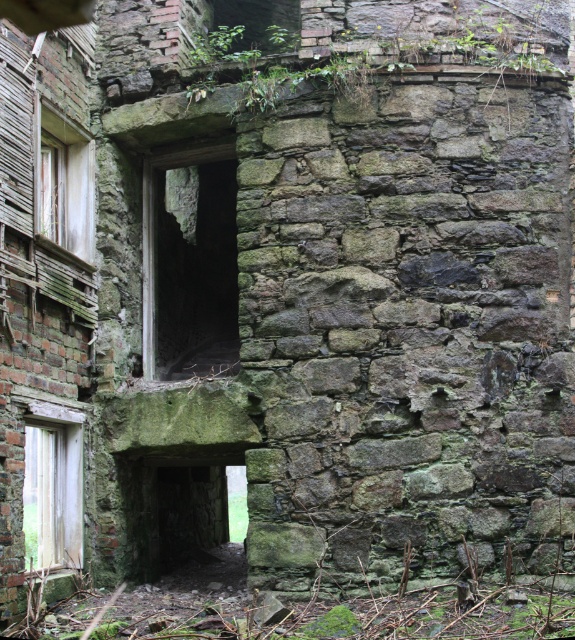
Does point (216, 234) lie behind point (28, 436)?

Yes, it is behind point (28, 436).

Is green stone window at center closer to camera compared to wooden door at left?

No, green stone window at center is behind wooden door at left.

At what (x,y) coordinates should I click in order to perform the action: click on green stone window at center. Please return your answer as a coordinate pair (x, y). The image size is (575, 640). Looking at the image, I should click on pos(189,262).

Identify the location of green stone window at center. (189, 262).

Which is above, green stone window at center or wooden window at left?

Positioned higher is wooden window at left.

This screenshot has height=640, width=575. What do you see at coordinates (189, 262) in the screenshot?
I see `green stone window at center` at bounding box center [189, 262].

Describe the element at coordinates (189, 262) in the screenshot. The height and width of the screenshot is (640, 575). I see `green stone window at center` at that location.

Where is `green stone window at center`? Image resolution: width=575 pixels, height=640 pixels. green stone window at center is located at coordinates (189, 262).

Which is below, wooden door at left or wooden window at left?

Positioned lower is wooden door at left.

How far apart are wooden door at left and wooden window at left?

wooden door at left is 8.81 feet from wooden window at left.

Identify the location of wooden door at left. (52, 486).